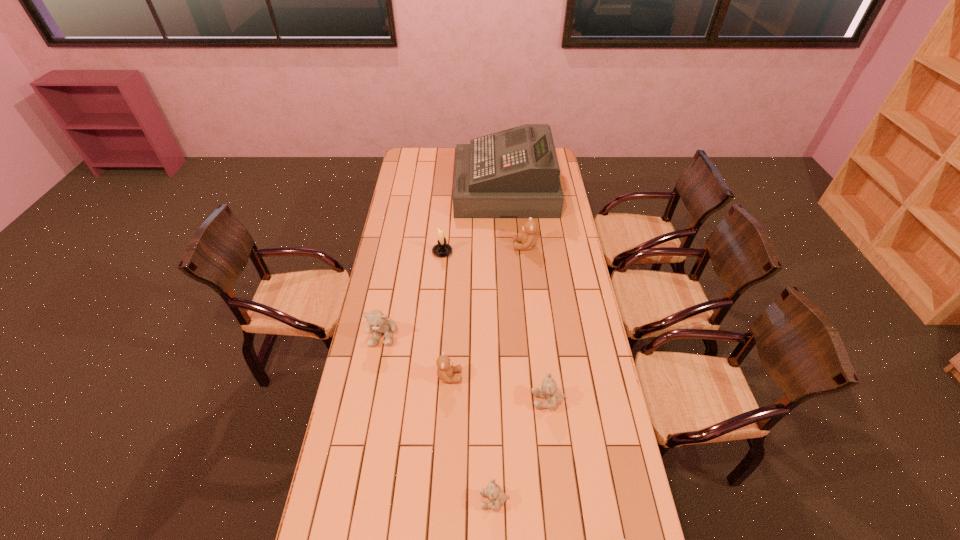
Where is `free space located 0.330m on the face of the fourth farthest object`? free space located 0.330m on the face of the fourth farthest object is located at coordinates coord(364,431).

Identify the location of free space located on the front-facing side of the second teddy bear from left to right. (526, 376).

What are the coordinates of `free spot located on the face of the rightmost gray teddy bear` in the screenshot? It's located at point(424,400).

Where is `vacant region located on the face of the rightmost gray teddy bear`? vacant region located on the face of the rightmost gray teddy bear is located at coordinates (487, 400).

The image size is (960, 540). Find the location of `vacant area situated on the face of the rightmost gray teddy bear`. vacant area situated on the face of the rightmost gray teddy bear is located at coordinates (484, 400).

Where is `vacant space located on the face of the second gray teddy bear from left to right`? The image size is (960, 540). vacant space located on the face of the second gray teddy bear from left to right is located at coordinates (361, 500).

The width and height of the screenshot is (960, 540). I want to click on vacant space located on the face of the second gray teddy bear from left to right, so click(384, 500).

The width and height of the screenshot is (960, 540). Identify the location of free spot located on the face of the second gray teddy bear from left to right. (367, 500).

Locate an element on the screen. This screenshot has height=540, width=960. object that is at the far edge is located at coordinates (514, 173).

At what (x,y) coordinates should I click in order to perform the action: click on object situated at the left edge. Please return your answer as a coordinate pair (x, y). Looking at the image, I should click on (376, 320).